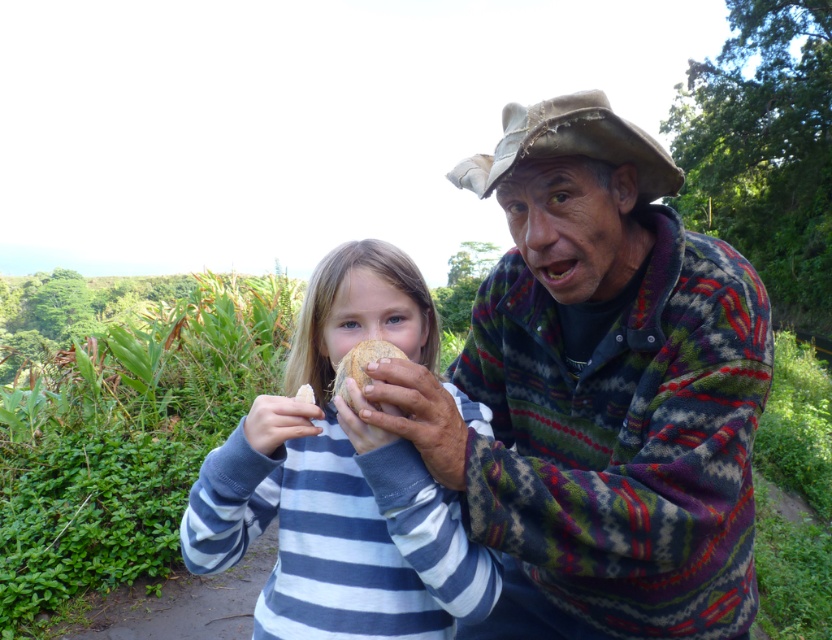
Consider the image. Is the position of multicolored knitted sweater at center more distant than that of brown matte coconut at center?

No, it is not.

Can you confirm if multicolored knitted sweater at center is wider than brown matte coconut at center?

Correct, the width of multicolored knitted sweater at center exceeds that of brown matte coconut at center.

Describe the element at coordinates (600, 392) in the screenshot. This screenshot has width=832, height=640. I see `multicolored knitted sweater at center` at that location.

This screenshot has height=640, width=832. Identify the location of multicolored knitted sweater at center. (600, 392).

The height and width of the screenshot is (640, 832). In order to click on blue striped sweater at center in this screenshot , I will do `click(342, 481)`.

Does point (250, 420) come closer to viewer compared to point (374, 358)?

No, (250, 420) is further to viewer.

The width and height of the screenshot is (832, 640). In order to click on blue striped sweater at center in this screenshot , I will do tap(342, 481).

Between point (637, 234) and point (301, 337), which one is positioned behind?

Point (637, 234)

Which is in front, point (504, 296) or point (355, 602)?

Positioned in front is point (355, 602).

At what (x,y) coordinates should I click in order to perform the action: click on multicolored knitted sweater at center. Please return your answer as a coordinate pair (x, y). This screenshot has width=832, height=640. Looking at the image, I should click on (600, 392).